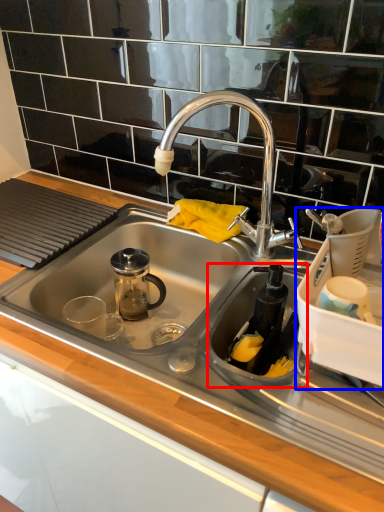
Question: Among these objects, which one is farthest to the camera, appliance (highlighted by a red box) or appliance (highlighted by a blue box)?

Choices:
 (A) appliance
 (B) appliance

Answer: (A)